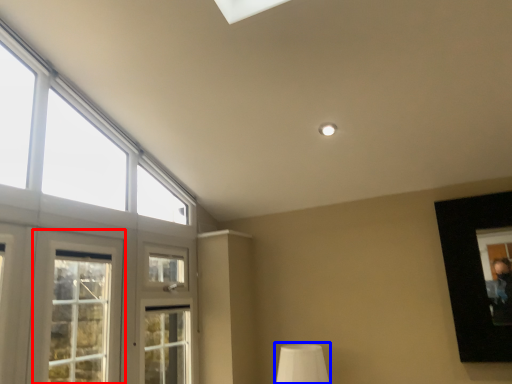
Question: Which object is closer to the camera taking this photo, window (highlighted by a red box) or table lamp (highlighted by a blue box)?

Choices:
 (A) window
 (B) table lamp

Answer: (A)